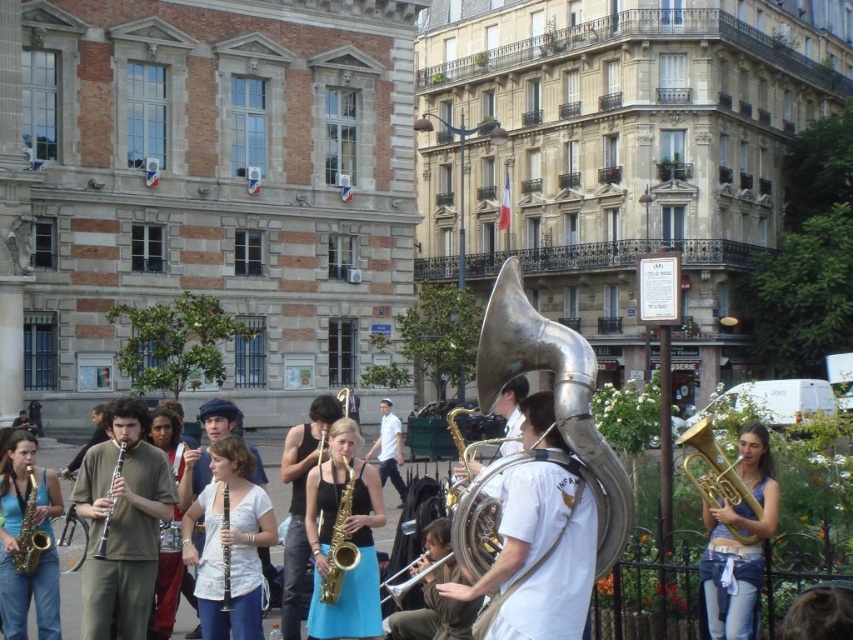
From the picture: You are a photographer standing in the square and want to take a photo that includes both the white matte shirt at center and the gold saxophone at lower left. Based on their positions, which object should you ensure is placed lower in your camera frame?

The white matte shirt at center should be placed lower in the camera frame because it is located below the gold saxophone at lower left.

You are a street performer who just finished playing your instruments. You need to pack your equipment. You have a brushed metal saxophone at lower left and a silver metallic flute at center. Which instrument should you pack first if you want to place the taller one into your case first?

The brushed metal saxophone at lower left is taller than the silver metallic flute at center, so you should pack the brushed metal saxophone at lower left first.

You are a street performer who wants to carry both the silver metallic bass horn at center and the gold shiny saxophone at center in a single case. The case can only accommodate the wider of the two instruments. Which instrument should determine the minimum width of the case?

The silver metallic bass horn at center is wider than the gold shiny saxophone at center, so the case should be sized to accommodate the silver metallic bass horn at center.